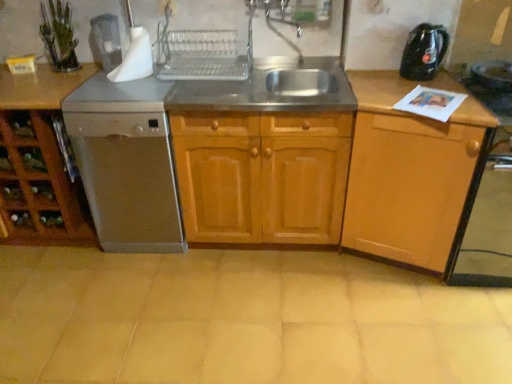
Question: Is brown wood cabinet at left, which ranks as the 1th cabinetry in left-to-right order, facing towards light brown wood cabinet at right, marked as the 1th cabinetry in a right-to-left arrangement?

Choices:
 (A) no
 (B) yes

Answer: (A)

Question: Is brown wood cabinet at left, which ranks as the 1th cabinetry in left-to-right order, surrounding light brown wood cabinet at right, the 3th cabinetry when ordered from left to right?

Choices:
 (A) no
 (B) yes

Answer: (A)

Question: Is brown wood cabinet at left, the 3th cabinetry viewed from the right, in contact with light brown wood cabinet at right, marked as the 1th cabinetry in a right-to-left arrangement?

Choices:
 (A) yes
 (B) no

Answer: (B)

Question: Does brown wood cabinet at left, which ranks as the 1th cabinetry in left-to-right order, appear on the left side of light brown wood cabinet at right, the 3th cabinetry when ordered from left to right?

Choices:
 (A) no
 (B) yes

Answer: (B)

Question: Is brown wood cabinet at left, the 3th cabinetry viewed from the right, oriented away from light brown wood cabinet at right, the 3th cabinetry when ordered from left to right?

Choices:
 (A) yes
 (B) no

Answer: (B)

Question: Is brown wood cabinet at left, the 3th cabinetry viewed from the right, not inside light brown wood cabinet at right, marked as the 1th cabinetry in a right-to-left arrangement?

Choices:
 (A) no
 (B) yes

Answer: (B)

Question: From a real-world perspective, is beige ceramic tile at center located beneath white plastic electric outlet at upper center?

Choices:
 (A) no
 (B) yes

Answer: (B)

Question: Is beige ceramic tile at center far from white plastic electric outlet at upper center?

Choices:
 (A) no
 (B) yes

Answer: (B)

Question: Considering the relative sizes of beige ceramic tile at center and white plastic electric outlet at upper center in the image provided, is beige ceramic tile at center bigger than white plastic electric outlet at upper center?

Choices:
 (A) yes
 (B) no

Answer: (A)

Question: Is beige ceramic tile at center further to the viewer compared to white plastic electric outlet at upper center?

Choices:
 (A) yes
 (B) no

Answer: (B)

Question: Is beige ceramic tile at center aimed at white plastic electric outlet at upper center?

Choices:
 (A) no
 (B) yes

Answer: (A)

Question: Is beige ceramic tile at center beside white plastic electric outlet at upper center?

Choices:
 (A) no
 (B) yes

Answer: (A)

Question: From a real-world perspective, is beige ceramic tile at center physically above brown wood cabinet at left, which ranks as the 1th cabinetry in left-to-right order?

Choices:
 (A) no
 (B) yes

Answer: (A)